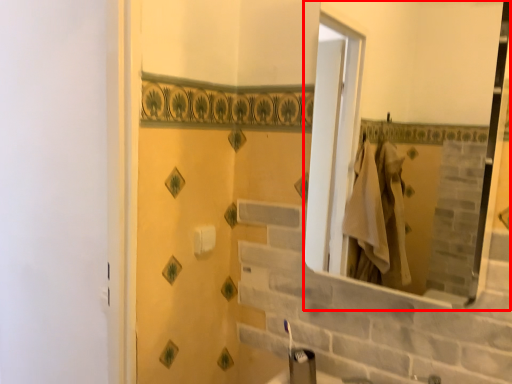
Question: From the image's perspective, considering the relative positions of mirror (annotated by the red box) and toilet paper in the image provided, where is mirror (annotated by the red box) located with respect to the staircase?

Choices:
 (A) above
 (B) below

Answer: (A)